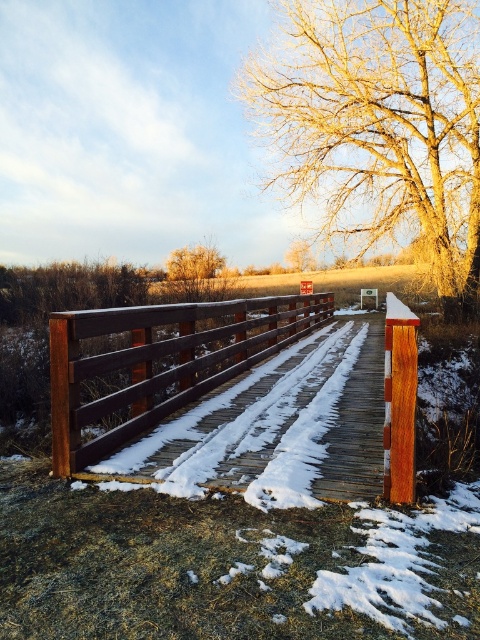
In the scene shown: You are standing on the wooden bridge covered in snow and looking towards the trees. Which tree, the brown textured tree at center or the bare brown tree at upper center, would appear larger in your view?

The brown textured tree at center appears larger because it is closer to the viewer than the bare brown tree at upper center.

You are standing at the point labeled as point [193,262] on the wooden bridge. What object are you facing directly ahead?

The point [193,262] corresponds to the brown textured tree at center, so you are facing directly towards the brown textured tree at center.

You are standing at the origin point of the coordinate system and want to cross the brown wooden bridge at center. Based on the coordinate provided, in which direction should you move to reach the bridge?

The brown wooden bridge at center is located at coordinate point 0.561 on the x axis and 0.335 on the y axis. To reach it from the origin, you should move right along the x axis and forward along the y axis.